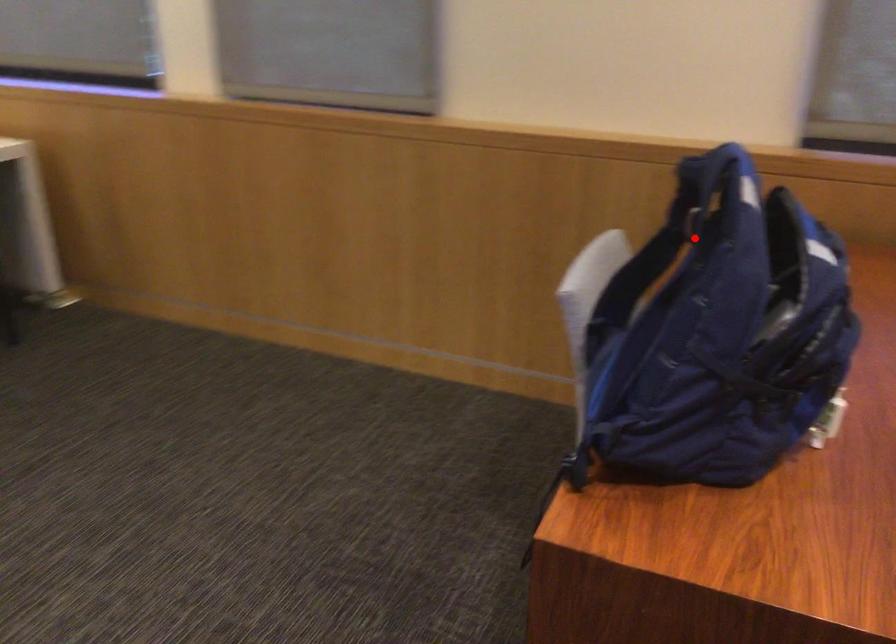
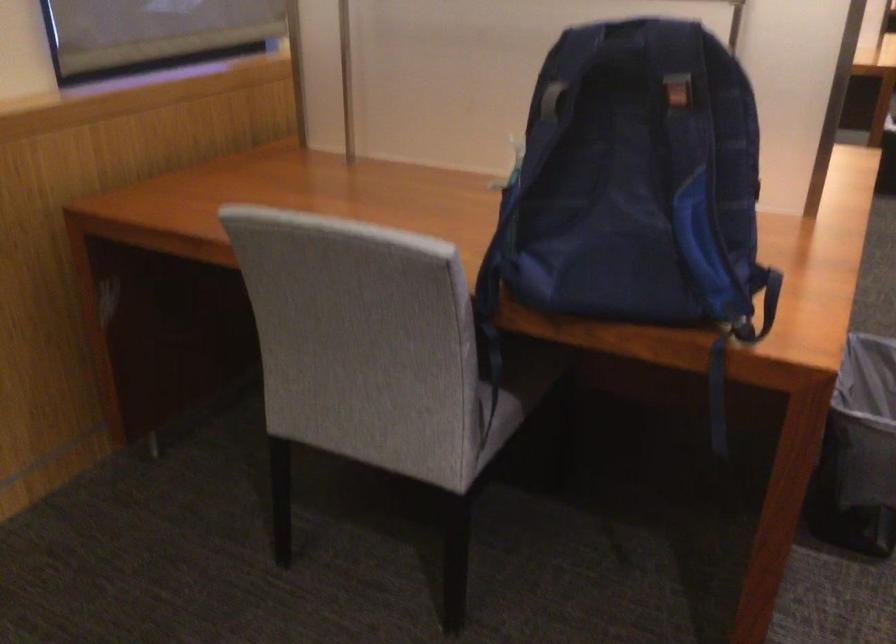
Where in the second image is the point corresponding to the highlighted location from the first image?

(677, 93)